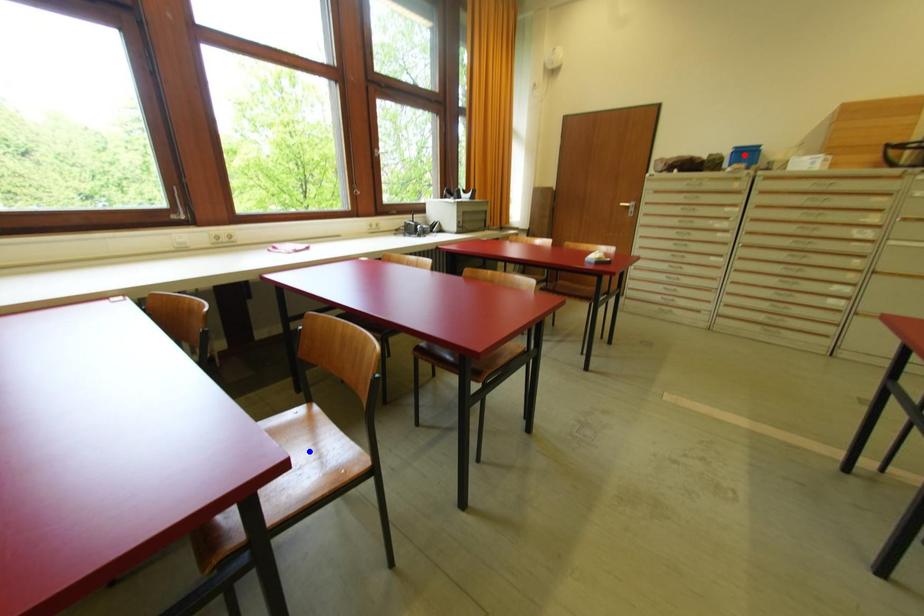
Question: In the image, two points are highlighted. Which point is nearer to the camera? Reply with the corresponding letter.

Choices:
 (A) blue point
 (B) red point

Answer: (A)